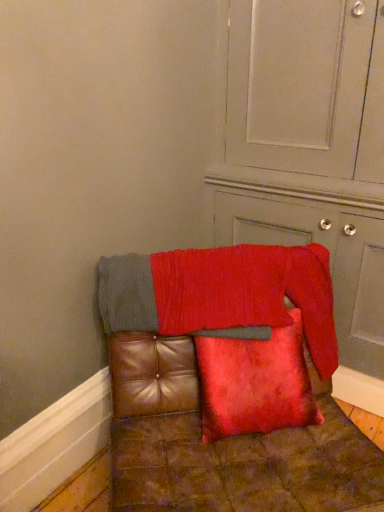
Question: From the image's perspective, is red textured blanket at center on velvet red cushion at lower right?

Choices:
 (A) no
 (B) yes

Answer: (A)

Question: Can you confirm if red textured blanket at center is wider than velvet red cushion at lower right?

Choices:
 (A) no
 (B) yes

Answer: (A)

Question: Would you say red textured blanket at center is a long distance from velvet red cushion at lower right?

Choices:
 (A) yes
 (B) no

Answer: (B)

Question: Is red textured blanket at center turned away from velvet red cushion at lower right?

Choices:
 (A) no
 (B) yes

Answer: (B)

Question: From the image's perspective, would you say red textured blanket at center is shown under velvet red cushion at lower right?

Choices:
 (A) no
 (B) yes

Answer: (B)

Question: In terms of size, does red textured blanket at center appear bigger or smaller than velvet red pillow at center?

Choices:
 (A) big
 (B) small

Answer: (A)

Question: Would you say red textured blanket at center is to the left or to the right of velvet red pillow at center in the picture?

Choices:
 (A) left
 (B) right

Answer: (A)

Question: Considering the positions of red textured blanket at center and velvet red pillow at center in the image, is red textured blanket at center wider or thinner than velvet red pillow at center?

Choices:
 (A) wide
 (B) thin

Answer: (A)

Question: From the image's perspective, is red textured blanket at center positioned above or below velvet red pillow at center?

Choices:
 (A) above
 (B) below

Answer: (A)

Question: Does point (286, 98) appear closer or farther from the camera than point (195, 342)?

Choices:
 (A) farther
 (B) closer

Answer: (A)

Question: Looking at the image, does velvet red cushion at lower right seem bigger or smaller compared to leather cushion at center?

Choices:
 (A) small
 (B) big

Answer: (B)

Question: From the image's perspective, is velvet red cushion at lower right positioned above or below leather cushion at center?

Choices:
 (A) below
 (B) above

Answer: (B)

Question: Looking at their shapes, would you say velvet red cushion at lower right is wider or thinner than leather cushion at center?

Choices:
 (A) wide
 (B) thin

Answer: (B)

Question: In the image, is velvet red pillow at center positioned in front of or behind velvet red cushion at lower right?

Choices:
 (A) behind
 (B) front

Answer: (A)

Question: From a real-world perspective, is velvet red pillow at center positioned above or below velvet red cushion at lower right?

Choices:
 (A) above
 (B) below

Answer: (B)